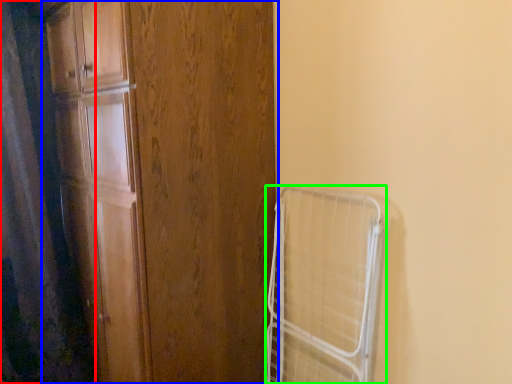
Question: Considering the real-world distances, which object is farthest from shower curtain (highlighted by a red box)? door (highlighted by a blue box) or cage (highlighted by a green box)?

Choices:
 (A) door
 (B) cage

Answer: (B)